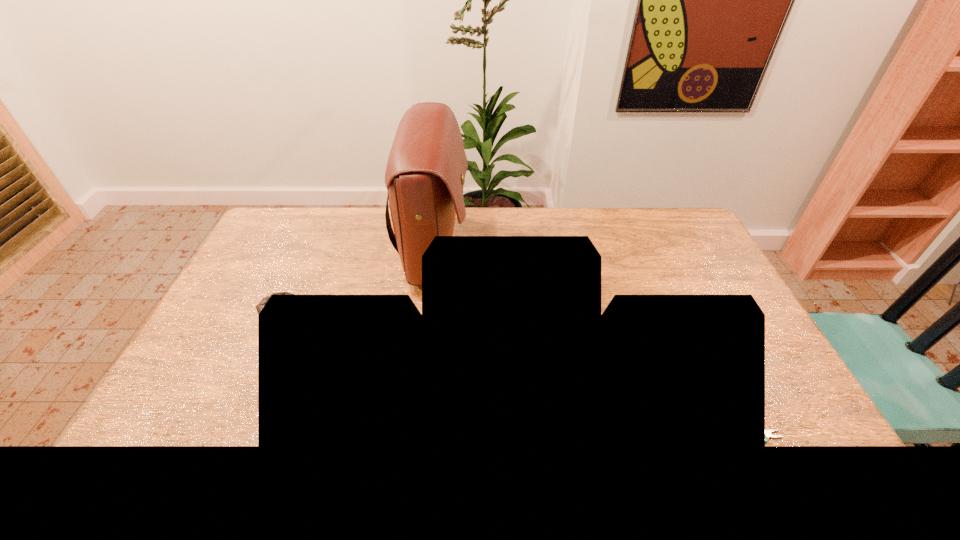
Where is `free region at the near right corner of the desktop`? free region at the near right corner of the desktop is located at coordinates (801, 449).

Locate an element on the screen. free space that is in between the shortest object and the second shortest object is located at coordinates (522, 376).

Find the location of a particular element. The image size is (960, 540). free space that is in between the pliers and the beanbag is located at coordinates (522, 376).

You are a GUI agent. You are given a task and a screenshot of the screen. Output one action in this format:
    pyautogui.click(x=<x>, y=<y>)
    Task: Click on the unoccupied area between the satchel and the leftmost object
    
    Given the screenshot: What is the action you would take?
    pyautogui.click(x=360, y=283)

You are a GUI agent. You are given a task and a screenshot of the screen. Output one action in this format:
    pyautogui.click(x=<x>, y=<y>)
    Task: Click on the object that is the second closest to the rightmost object
    
    Given the screenshot: What is the action you would take?
    pyautogui.click(x=259, y=307)

Identify the location of object that stands as the closest to the pliers. [x=425, y=174].

This screenshot has width=960, height=540. Find the location of `free spot that satisfies the following two spatial constraints: 1. on the front side of the leftmost object; 2. on the right side of the nearest object`. free spot that satisfies the following two spatial constraints: 1. on the front side of the leftmost object; 2. on the right side of the nearest object is located at coordinates (233, 436).

At what (x,y) coordinates should I click in order to perform the action: click on free space in the image that satisfies the following two spatial constraints: 1. on the open flap of the tallest object; 2. on the front side of the second tallest object. Please return your answer as a coordinate pair (x, y). Looking at the image, I should click on (426, 315).